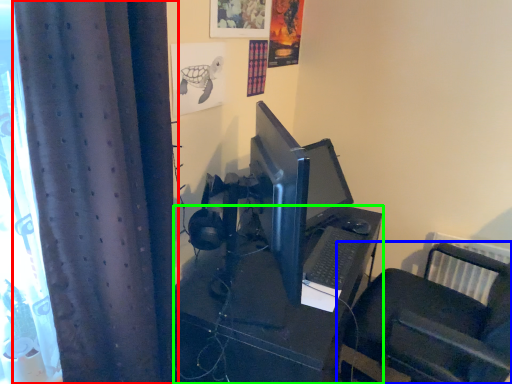
Question: Estimate the real-world distances between objects in this image. Which object is farther from curtain (highlighted by a red box), furniture (highlighted by a blue box) or desk (highlighted by a green box)?

Choices:
 (A) furniture
 (B) desk

Answer: (A)